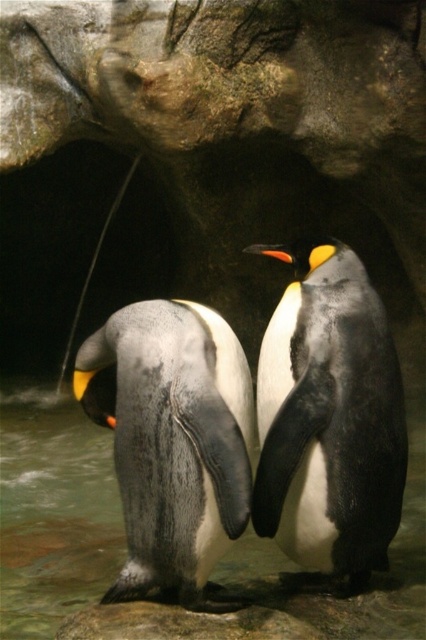
Is gray matte penguin at center shorter than translucent wet rock at center?

No.

Is point (103, 387) positioned behind point (356, 632)?

Yes, point (103, 387) is behind point (356, 632).

The width and height of the screenshot is (426, 640). I want to click on gray matte penguin at center, so click(x=172, y=440).

Which is above, white matte penguin at center or gray matte penguin at center?

Positioned higher is white matte penguin at center.

Can you confirm if white matte penguin at center is taller than gray matte penguin at center?

Correct, white matte penguin at center is much taller as gray matte penguin at center.

Does point (313, 452) lie in front of point (184, 557)?

No, (313, 452) is further to viewer.

The image size is (426, 640). Identify the location of white matte penguin at center. (328, 417).

Measure the distance between point (304, 353) and camera.

Point (304, 353) is 7.46 feet from camera.

Between white matte penguin at center and translucent wet rock at center, which one is positioned lower?

Positioned lower is translucent wet rock at center.

The height and width of the screenshot is (640, 426). Identify the location of white matte penguin at center. (328, 417).

This screenshot has height=640, width=426. I want to click on white matte penguin at center, so click(328, 417).